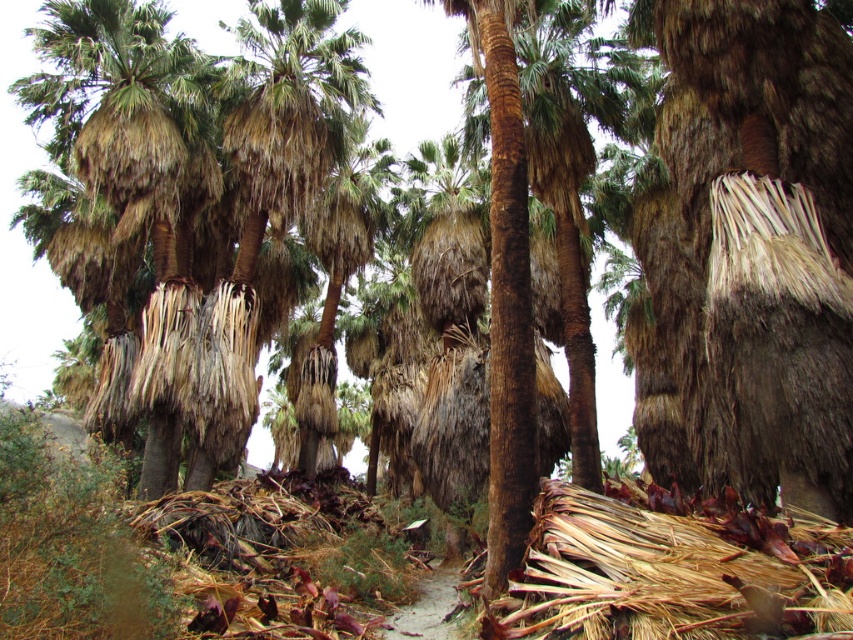
You are a hiker trying to navigate through the desert grove. You see the brown textured palm tree at lower left and the brown dirt path at center. Which object is wider?

The brown textured palm tree at lower left might be wider than brown dirt path at center according to the description.

You are a hiker trying to find shade in the desert. You see the brown textured palm tree at lower left and the brown dirt path at center. Which object provides more shade?

The brown textured palm tree at lower left is much taller than the brown dirt path at center, so it likely provides more shade.

From the picture: You are a hiker trying to navigate through the palm grove. You see the brown textured palm tree at lower left and the brown dirt path at center. Which object is positioned to the left of the other?

The brown textured palm tree at lower left is positioned to the left of the brown dirt path at center.